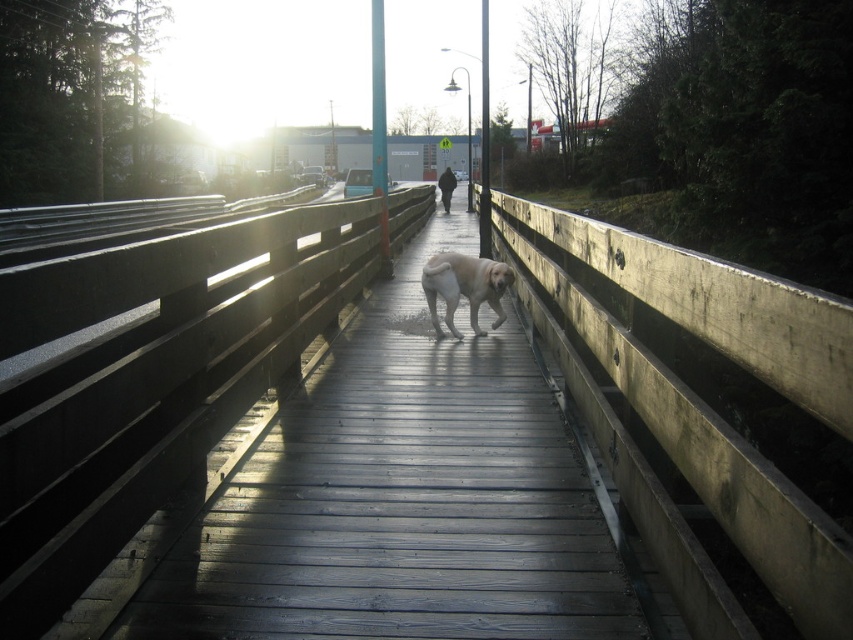
You are standing on the wooden bridge at center and want to pet the golden fur dog at center. Is the dog on the bridge or above the bridge?

The wooden bridge at center is positioned under golden fur dog at center, so the dog is above the bridge.

You are standing on the wooden bridge at center. Looking down, you notice that the wooden planks forming the railing are horizontal. In which direction do these planks run relative to the length of the bridge?

The wooden planks forming the railing on the wooden bridge at center run horizontally, which means they are perpendicular to the length of the bridge, as the bridge is a straight structure and the planks are placed horizontally along its sides.